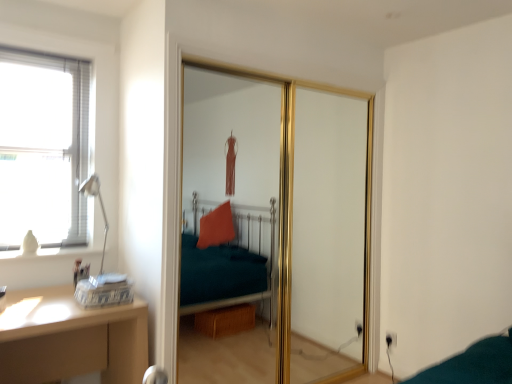
Question: Considering their positions, is wooden desk at lower left located in front of or behind matte silver table lamp at left?

Choices:
 (A) behind
 (B) front

Answer: (B)

Question: From a real-world perspective, is wooden desk at lower left above or below matte silver table lamp at left?

Choices:
 (A) below
 (B) above

Answer: (A)

Question: Which object is the closest to the matte silver table lamp at left?

Choices:
 (A) wooden desk at lower left
 (B) gold metallic sliding door at center

Answer: (A)

Question: Which object is the closest to the gold metallic sliding door at center?

Choices:
 (A) wooden desk at lower left
 (B) matte silver table lamp at left

Answer: (A)